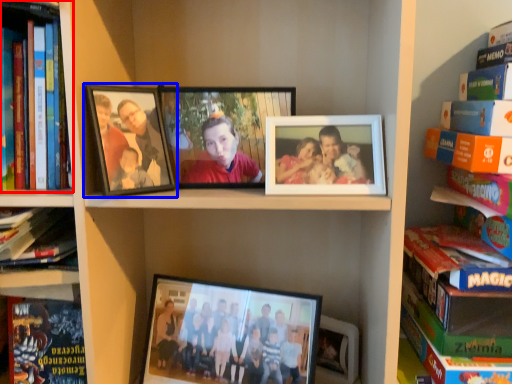
Question: Which object appears closest to the camera in this image, book (highlighted by a red box) or picture frame (highlighted by a blue box)?

Choices:
 (A) book
 (B) picture frame

Answer: (A)